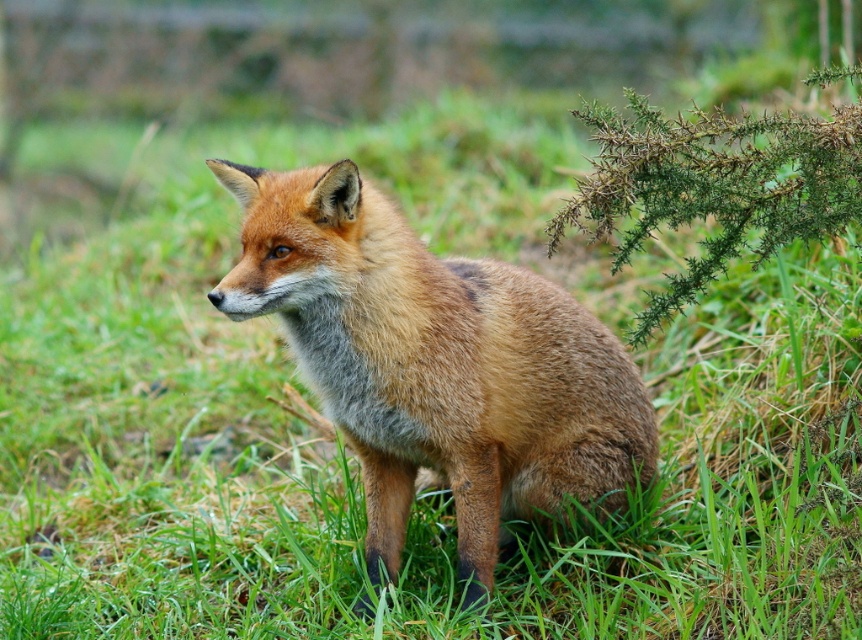
Question: Does shiny orange fur fox at center have a lesser width compared to green spiky plant at upper right?

Choices:
 (A) yes
 (B) no

Answer: (B)

Question: Which point is closer to the camera?

Choices:
 (A) green spiky plant at upper right
 (B) shiny orange fur fox at center

Answer: (A)

Question: Does shiny orange fur fox at center have a greater width compared to green spiky plant at upper right?

Choices:
 (A) no
 (B) yes

Answer: (B)

Question: Which point is closer to the camera?

Choices:
 (A) (661, 205)
 (B) (392, 573)

Answer: (A)

Question: Among these points, which one is farthest from the camera?

Choices:
 (A) pyautogui.click(x=351, y=384)
 (B) pyautogui.click(x=657, y=292)

Answer: (B)

Question: Is shiny orange fur fox at center thinner than green spiky plant at upper right?

Choices:
 (A) no
 (B) yes

Answer: (A)